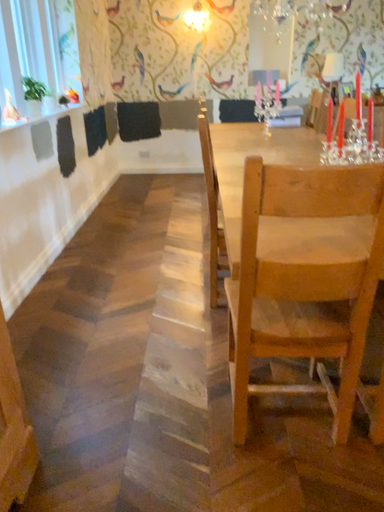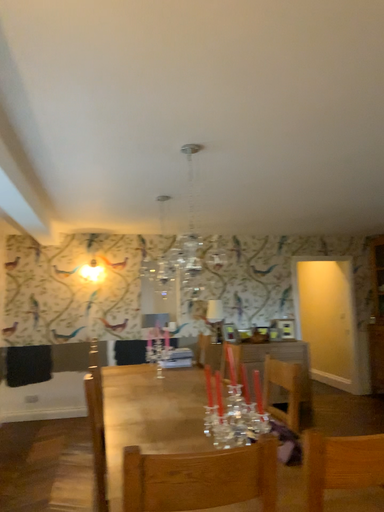
Question: Which way did the camera rotate in the video?

Choices:
 (A) rotated downward
 (B) rotated upward

Answer: (B)